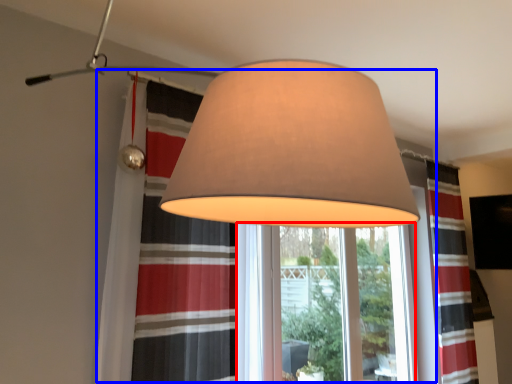
Question: Which point is closer to the camera, window frame (highlighted by a red box) or bay window (highlighted by a blue box)?

Choices:
 (A) window frame
 (B) bay window

Answer: (B)